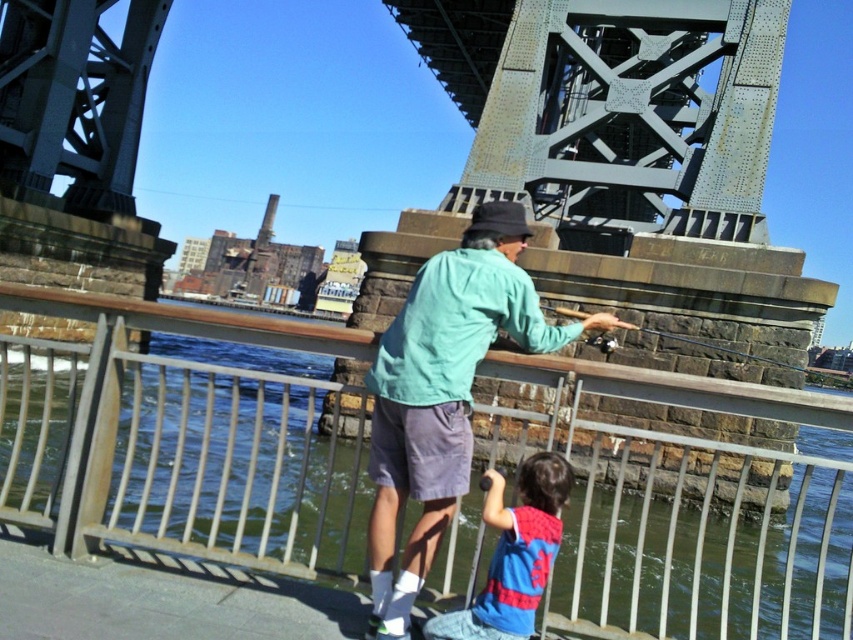
At what (x,y) coordinates should I click in order to perform the action: click on teal fabric jacket at center. Please return your answer as a coordinate pair (x, y). This screenshot has width=853, height=640. Looking at the image, I should click on 444,392.

Who is shorter, teal fabric jacket at center or metallic rod at center?

With less height is teal fabric jacket at center.

Between point (370, 580) and point (663, 333), which one is positioned behind?

The point (663, 333) is behind.

Where is `teal fabric jacket at center`? The height and width of the screenshot is (640, 853). teal fabric jacket at center is located at coordinates (444, 392).

Who is taller, blue cotton shirt at lower center or metallic rod at center?

metallic rod at center

Which is in front, point (500, 490) or point (811, 374)?

Point (500, 490) is more forward.

Locate an element on the screen. blue cotton shirt at lower center is located at coordinates (514, 554).

Find the location of a particular element. This screenshot has width=853, height=640. blue cotton shirt at lower center is located at coordinates (514, 554).

Does point (250, 426) lie behind point (527, 284)?

Yes.

The height and width of the screenshot is (640, 853). What do you see at coordinates (178, 440) in the screenshot? I see `metal/rustic rail at center` at bounding box center [178, 440].

The height and width of the screenshot is (640, 853). Describe the element at coordinates (178, 440) in the screenshot. I see `metal/rustic rail at center` at that location.

Find the location of `metal/rustic rail at center`. metal/rustic rail at center is located at coordinates click(178, 440).